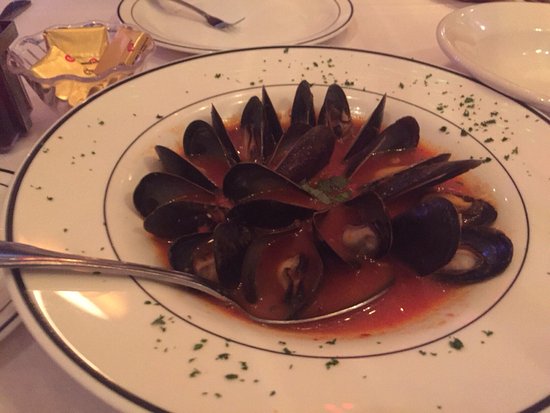
Image resolution: width=550 pixels, height=413 pixels. I want to click on fork, so click(214, 22).